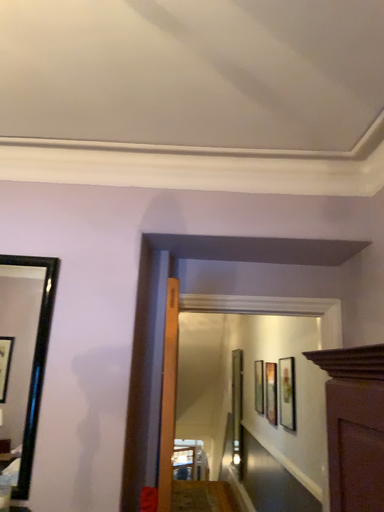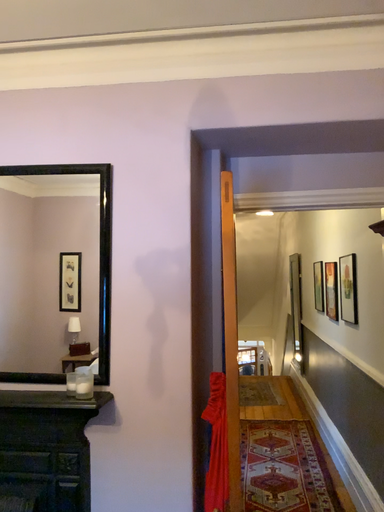
Question: Which way did the camera rotate in the video?

Choices:
 (A) rotated left
 (B) rotated right

Answer: (A)